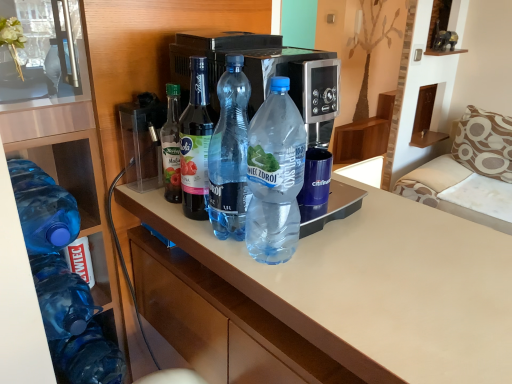
Image resolution: width=512 pixels, height=384 pixels. In order to click on space that is in front of transparent plastic bottle at center, which is the 3th bottle from left to right in this screenshot , I will do `click(221, 249)`.